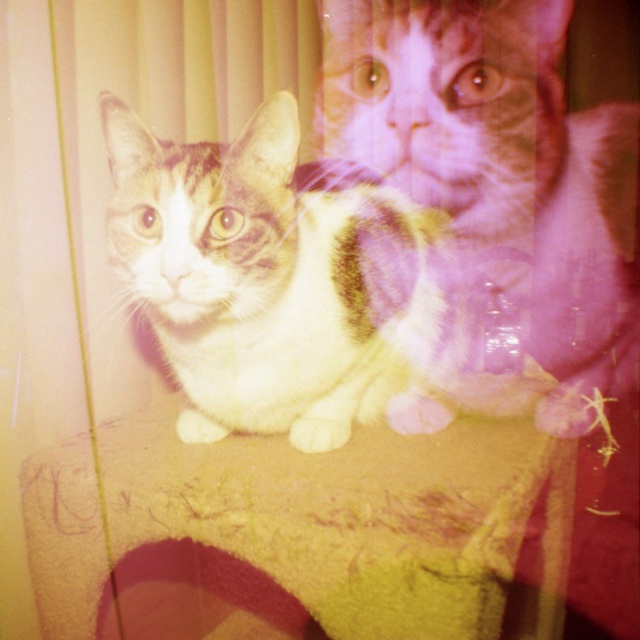
Question: Observing the image, what is the correct spatial positioning of white fur cat at center in reference to calico fur cat at center?

Choices:
 (A) above
 (B) below

Answer: (B)

Question: Where is white fur cat at center located in relation to calico fur cat at center in the image?

Choices:
 (A) above
 (B) below

Answer: (B)

Question: Is white fur cat at center wider than calico fur cat at center?

Choices:
 (A) yes
 (B) no

Answer: (B)

Question: Which point is closer to the camera?

Choices:
 (A) white fur cat at center
 (B) calico fur cat at center

Answer: (A)

Question: Which point is closer to the camera taking this photo?

Choices:
 (A) (163, 188)
 (B) (573, 216)

Answer: (A)